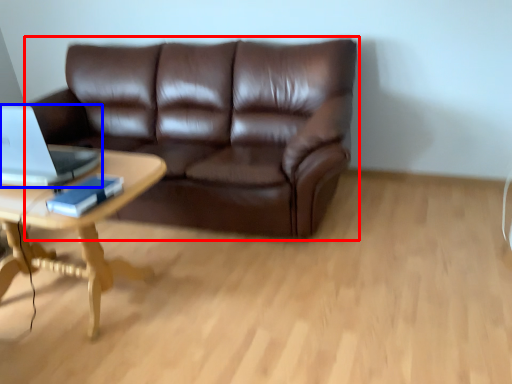
Question: Which of the following is the farthest to the observer, studio couch (highlighted by a red box) or laptop (highlighted by a blue box)?

Choices:
 (A) studio couch
 (B) laptop

Answer: (A)